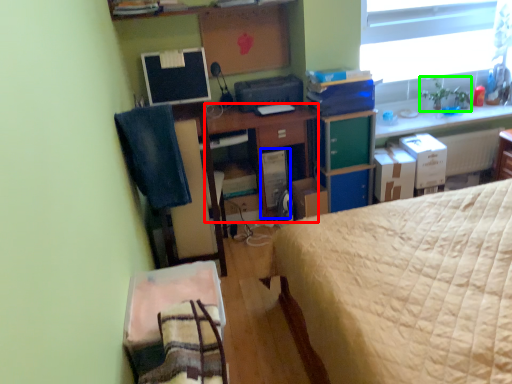
Question: Considering the real-world distances, which object is farthest from desk (highlighted by a red box)? computer tower (highlighted by a blue box) or houseplant (highlighted by a green box)?

Choices:
 (A) computer tower
 (B) houseplant

Answer: (B)